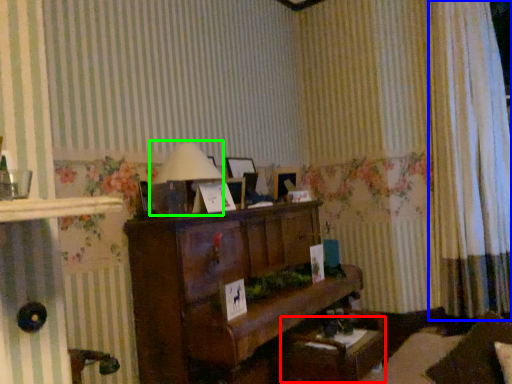
Question: Which object is the farthest from table (highlighted by a red box)? Choose among these: curtain (highlighted by a blue box) or table lamp (highlighted by a green box).

Choices:
 (A) curtain
 (B) table lamp

Answer: (A)